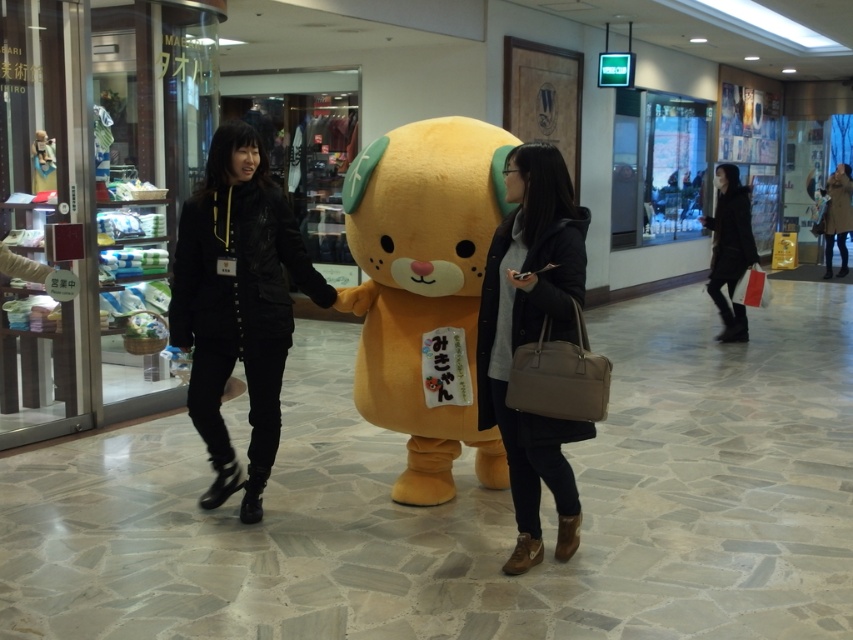
Question: Can you confirm if soft plush teddy bear at center is positioned below matte black coat at center?

Choices:
 (A) yes
 (B) no

Answer: (B)

Question: Does black leather jacket at center appear on the left side of matte black coat at center?

Choices:
 (A) yes
 (B) no

Answer: (A)

Question: Which point is closer to the camera?

Choices:
 (A) black leather jacket at center
 (B) matte black coat at center
 (C) black matte coat at right

Answer: (B)

Question: Considering the real-world distances, which object is farthest from the black matte coat at right?

Choices:
 (A) soft plush teddy bear at center
 (B) matte black coat at center

Answer: (B)

Question: Is soft plush teddy bear at center bigger than matte black coat at center?

Choices:
 (A) yes
 (B) no

Answer: (A)

Question: Among these points, which one is farthest from the camera?

Choices:
 (A) (503, 300)
 (B) (465, 330)
 (C) (238, 294)
 (D) (730, 259)

Answer: (D)